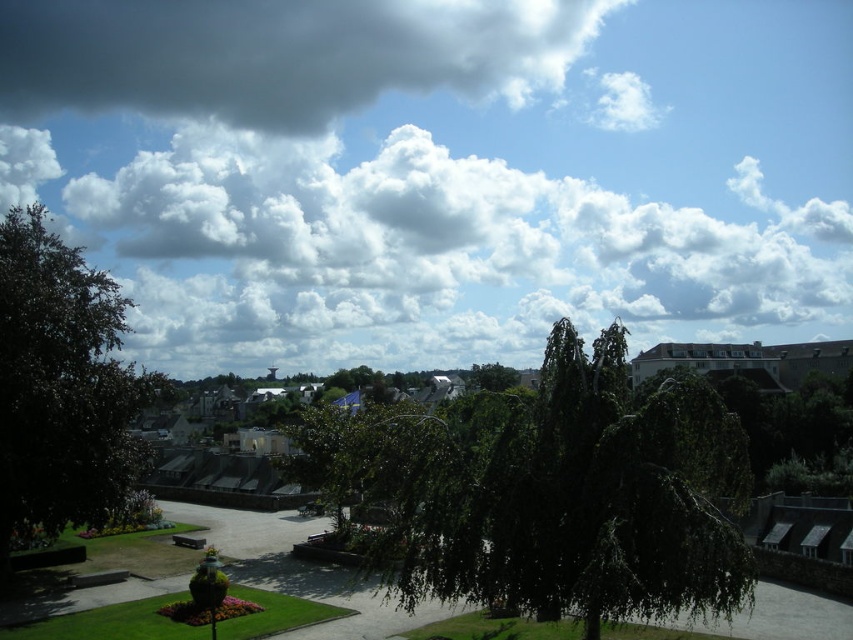
Question: Estimate the real-world distances between objects in this image. Which object is farther from the dark green leafy tree at center?

Choices:
 (A) green leafy tree at left
 (B) dark gray fluffy cloud at upper center

Answer: (B)

Question: Which is farther from the green leafy tree at left?

Choices:
 (A) dark green leafy tree at center
 (B) dark gray fluffy cloud at upper center

Answer: (B)

Question: Which is farther from the dark gray fluffy cloud at upper center?

Choices:
 (A) green leafy tree at left
 (B) dark green leafy tree at center

Answer: (B)

Question: Observing the image, what is the correct spatial positioning of dark green leafy tree at center in reference to green leafy tree at left?

Choices:
 (A) below
 (B) above

Answer: (A)

Question: Is dark green leafy tree at center above dark gray fluffy cloud at upper center?

Choices:
 (A) yes
 (B) no

Answer: (B)

Question: In this image, where is dark green leafy tree at center located relative to dark gray fluffy cloud at upper center?

Choices:
 (A) left
 (B) right

Answer: (B)